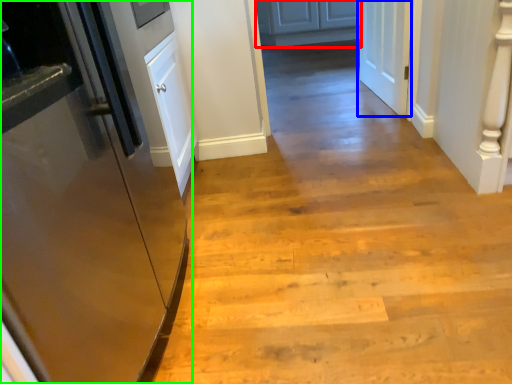
Question: Which is farther away from cabinetry (highlighted by a red box)? door (highlighted by a blue box) or door (highlighted by a green box)?

Choices:
 (A) door
 (B) door

Answer: (B)